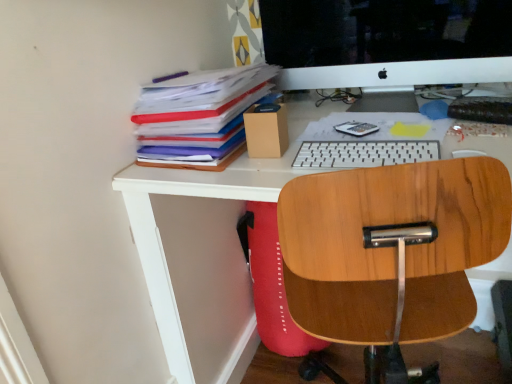
Locate an element on the screen. empty space that is ontop of white plastic keyboard at center (from a real-world perspective) is located at coordinates (349, 146).